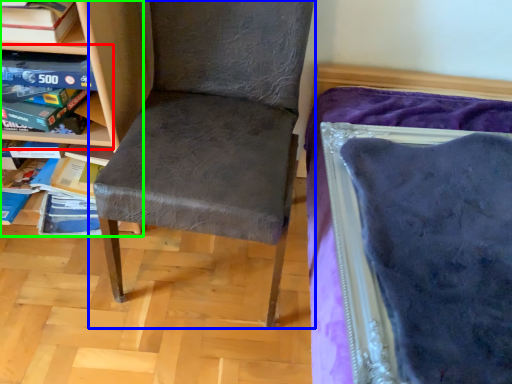
Question: Considering the real-world distances, which object is farthest from shelf (highlighted by a red box)? chair (highlighted by a blue box) or shelf (highlighted by a green box)?

Choices:
 (A) chair
 (B) shelf

Answer: (A)